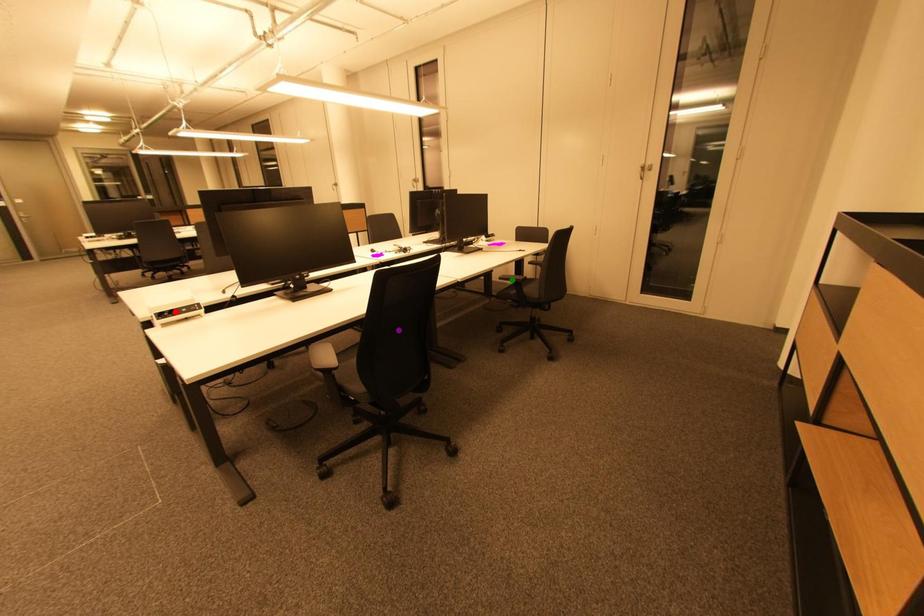
Order these from farthest to nearest:
- red point
- purple point
- green point

green point
purple point
red point